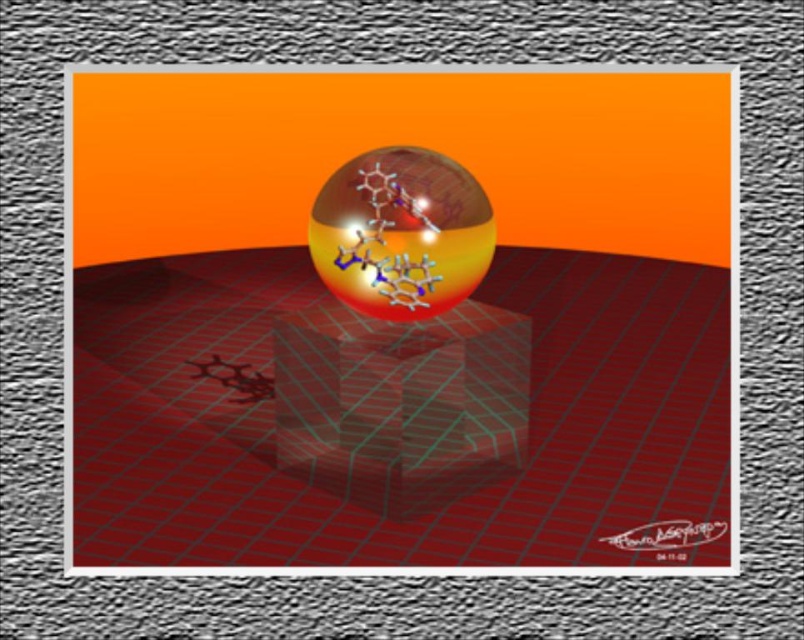
Consider the image. Between transparent glass cube at center and transparent glass sphere at center, which one has less height?

transparent glass sphere at center

Find the location of a particular element. The image size is (804, 640). transparent glass cube at center is located at coordinates (396, 420).

The height and width of the screenshot is (640, 804). I want to click on transparent glass cube at center, so click(x=396, y=420).